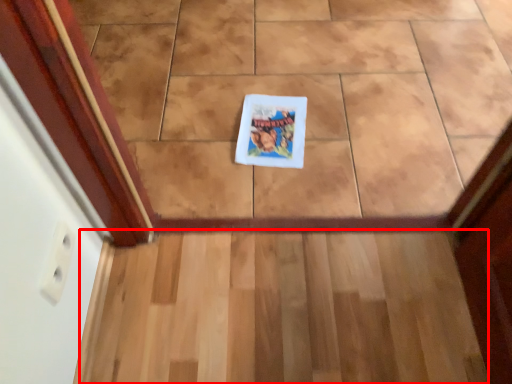
Question: From the image's perspective, where is stairs (annotated by the red box) located in relation to book cover in the image?

Choices:
 (A) below
 (B) above

Answer: (A)